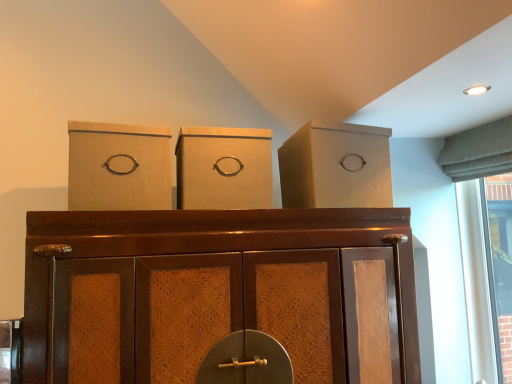
Question: From a real-world perspective, does brown wood cupboard at center stand above matte cardboard box at left, the 2th cardboard box in the right-to-left sequence?

Choices:
 (A) no
 (B) yes

Answer: (A)

Question: Is brown wood cupboard at center positioned far away from matte cardboard box at left, the 2th cardboard box in the right-to-left sequence?

Choices:
 (A) yes
 (B) no

Answer: (B)

Question: Considering the relative sizes of brown wood cupboard at center and matte cardboard box at left, the first cardboard box from the left, in the image provided, is brown wood cupboard at center taller than matte cardboard box at left, the first cardboard box from the left,?

Choices:
 (A) yes
 (B) no

Answer: (A)

Question: From the image's perspective, does brown wood cupboard at center appear lower than matte cardboard box at left, the first cardboard box from the left?

Choices:
 (A) yes
 (B) no

Answer: (A)

Question: Is matte cardboard box at left, the first cardboard box from the left, located within brown wood cupboard at center?

Choices:
 (A) no
 (B) yes

Answer: (A)

Question: Considering the relative sizes of brown wood cupboard at center and matte cardboard box at left, the 2th cardboard box in the right-to-left sequence, in the image provided, is brown wood cupboard at center shorter than matte cardboard box at left, the 2th cardboard box in the right-to-left sequence,?

Choices:
 (A) yes
 (B) no

Answer: (B)

Question: From a real-world perspective, is matte cardboard box at left, the first cardboard box from the left, under matte cardboard box at center, the second cardboard box in the left-to-right sequence?

Choices:
 (A) yes
 (B) no

Answer: (B)

Question: Would you consider matte cardboard box at left, the 2th cardboard box in the right-to-left sequence, to be distant from matte cardboard box at center, which appears as the first cardboard box when viewed from the right?

Choices:
 (A) yes
 (B) no

Answer: (B)

Question: From the image's perspective, does matte cardboard box at left, the 2th cardboard box in the right-to-left sequence, appear higher than matte cardboard box at center, the second cardboard box in the left-to-right sequence?

Choices:
 (A) yes
 (B) no

Answer: (A)

Question: From a real-world perspective, is matte cardboard box at left, the first cardboard box from the left, on top of matte cardboard box at center, which appears as the first cardboard box when viewed from the right?

Choices:
 (A) no
 (B) yes

Answer: (B)

Question: Does matte cardboard box at left, the first cardboard box from the left, have a greater height compared to matte cardboard box at center, which appears as the first cardboard box when viewed from the right?

Choices:
 (A) no
 (B) yes

Answer: (A)

Question: Does matte cardboard box at left, the first cardboard box from the left, appear on the left side of matte cardboard box at center, which appears as the first cardboard box when viewed from the right?

Choices:
 (A) yes
 (B) no

Answer: (A)

Question: Can you confirm if matte cardboard box at left, the first cardboard box from the left, is thinner than matte cardboard box at upper right?

Choices:
 (A) no
 (B) yes

Answer: (B)